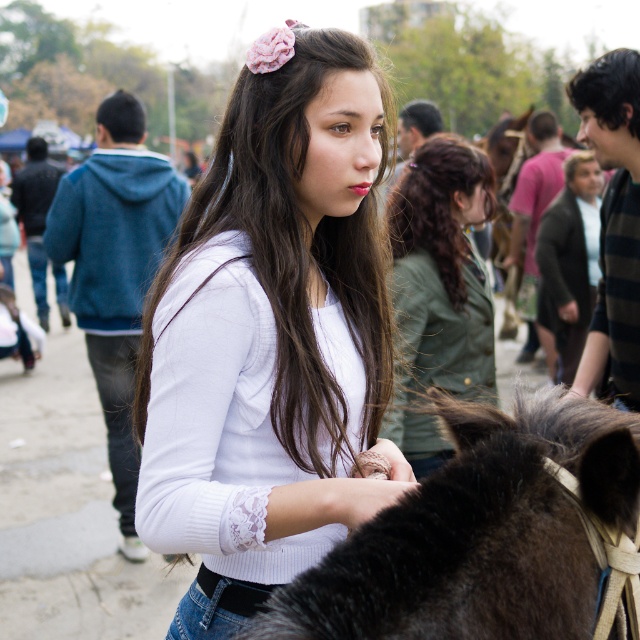
Does dark brown fur at center come in front of white lace shirt at center?

Yes, it is in front of white lace shirt at center.

Does dark brown fur at center have a smaller size compared to white lace shirt at center?

Indeed, dark brown fur at center has a smaller size compared to white lace shirt at center.

Is point (512, 572) farther from camera compared to point (461, 298)?

No.

Image resolution: width=640 pixels, height=640 pixels. Find the location of `dark brown fur at center`. dark brown fur at center is located at coordinates pyautogui.click(x=483, y=534).

Is white lace sweater at center above white lace shirt at center?

No.

In the scene shown: Between white lace sweater at center and white lace shirt at center, which one appears on the left side from the viewer's perspective?

From the viewer's perspective, white lace sweater at center appears more on the left side.

Is point (198, 452) less distant than point (396, 193)?

Yes, it is in front of point (396, 193).

Identify the location of white lace sweater at center. (272, 333).

Is white lace sweater at center to the right of dark brown fur at center from the viewer's perspective?

Incorrect, white lace sweater at center is not on the right side of dark brown fur at center.

Describe the element at coordinates (272, 333) in the screenshot. I see `white lace sweater at center` at that location.

Who is more distant from viewer, (161, 525) or (579, 596)?

The point (161, 525) is more distant.

You are a GUI agent. You are given a task and a screenshot of the screen. Output one action in this format:
    pyautogui.click(x=<x>, y=<y>)
    Task: Click on the white lace sweater at center
    This screenshot has width=640, height=640.
    Given the screenshot: What is the action you would take?
    pyautogui.click(x=272, y=333)